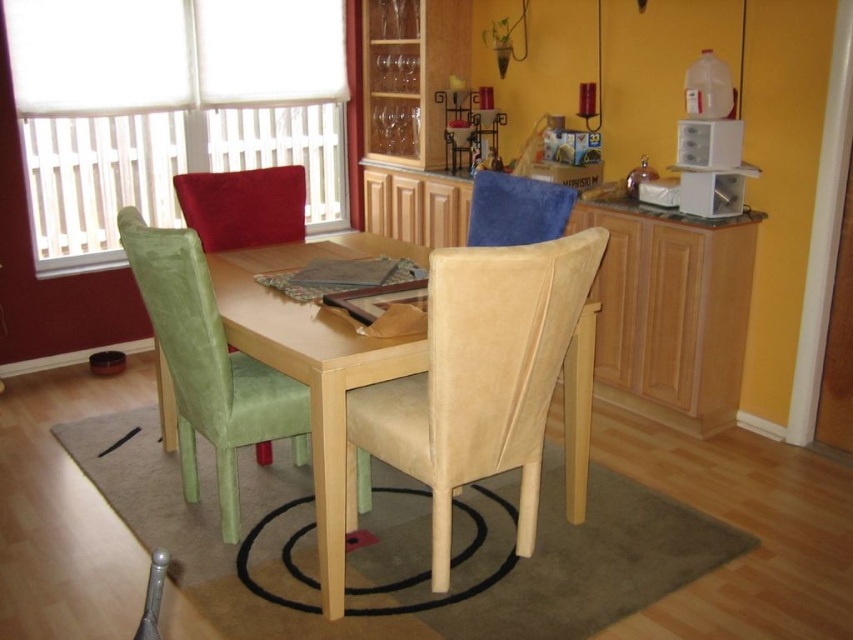
You are a delivery person carrying a package that is 1.2 meters long. You need to place it between the green fabric chair at left and the blue fabric chair at upper center. Is there enough space for the package to fit between them?

The distance between the green fabric chair at left and the blue fabric chair at upper center is 1.10 meters, which is shorter than the package length of 1.2 meters. Therefore, the package cannot fit between them.

You are planning to place a rectangular tablecloth on the dining table. The beige suede chair at center and the green fabric chair at left are both near the table. Considering their widths, which chair might require a wider tablecloth to accommodate its size?

The beige suede chair at center might require a wider tablecloth because it is wider than the green fabric chair at left according to the description.

You are planning to seat guests at the dining table. You have a large guest who prefers the most spacious chair. Which chair should they choose between the beige suede chair at center and the green fabric chair at left?

The beige suede chair at center is bigger than the green fabric chair at left, so the large guest should choose the beige suede chair at center for more space.